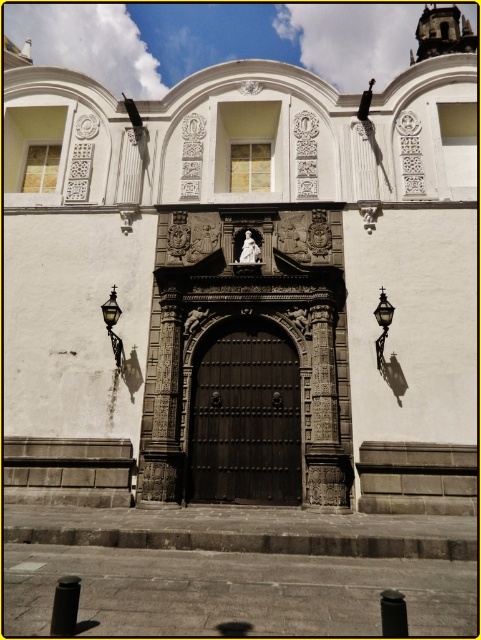
Is point (255, 412) closer to camera compared to point (113, 305)?

No, (255, 412) is further to viewer.

Is dark wood door at center thinner than bronze textured streetlamp at left?

Yes, dark wood door at center is thinner than bronze textured streetlamp at left.

What do you see at coordinates (244, 417) in the screenshot? I see `dark wood door at center` at bounding box center [244, 417].

Locate an element on the screen. The height and width of the screenshot is (640, 481). dark wood door at center is located at coordinates (244, 417).

Does point (110, 324) come in front of point (385, 305)?

No, (110, 324) is behind (385, 305).

Identify the location of bronze textured streetlamp at left. (113, 324).

Consider the image. Between dark wood door at center and matte black lantern at right, which one appears on the left side from the viewer's perspective?

Positioned to the left is dark wood door at center.

Is point (192, 384) behind point (380, 304)?

Yes, point (192, 384) is farther from viewer.

Locate an element on the screen. This screenshot has height=640, width=481. dark wood door at center is located at coordinates (244, 417).